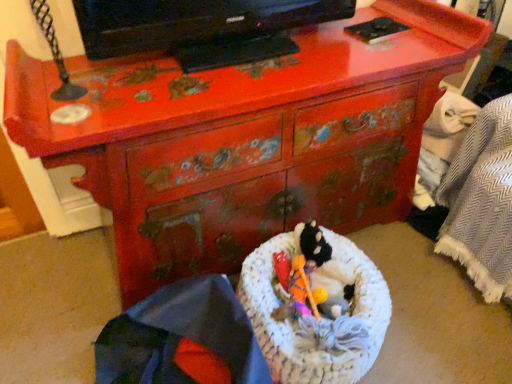
Identify the location of vacant area located to the right-hand side of white knitted laundry basket at center. point(435,308).